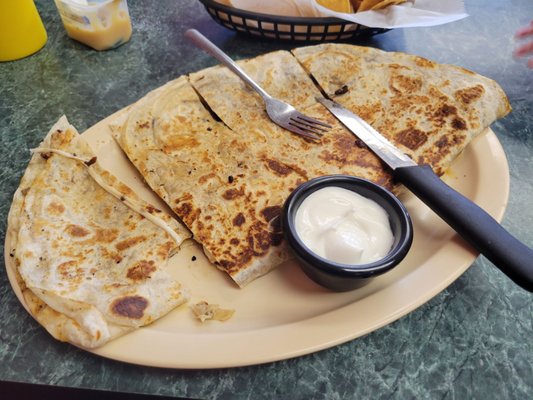
I want to click on place to hold fork, so click(206, 44).